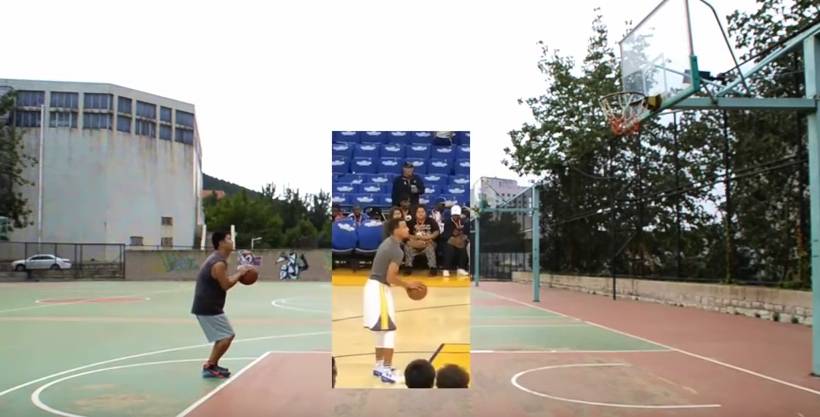
Find the location of `bracket`. bracket is located at coordinates click(725, 112).